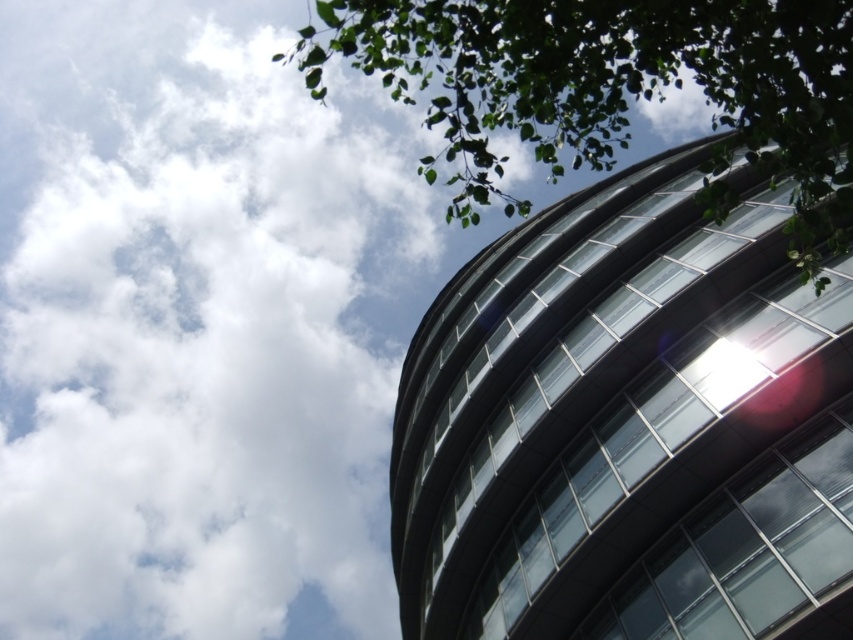
The height and width of the screenshot is (640, 853). What do you see at coordinates (196, 326) in the screenshot?
I see `white fluffy cloud at upper left` at bounding box center [196, 326].

Can you confirm if white fluffy cloud at upper left is smaller than transparent glass building at upper right?

Actually, white fluffy cloud at upper left might be larger than transparent glass building at upper right.

Between point (4, 285) and point (801, 580), which one is positioned in front?

Point (801, 580) is in front.

Where is `white fluffy cloud at upper left`? white fluffy cloud at upper left is located at coordinates (196, 326).

What do you see at coordinates (627, 422) in the screenshot? This screenshot has height=640, width=853. I see `transparent glass building at upper right` at bounding box center [627, 422].

Is transparent glass building at upper right wider than green leafy tree at upper right?

No.

Is point (534, 269) less distant than point (422, 51)?

No, (534, 269) is behind (422, 51).

This screenshot has width=853, height=640. I want to click on transparent glass building at upper right, so click(627, 422).

Which is behind, point (158, 196) or point (746, 157)?

The point (158, 196) is more distant.

Who is more forward, [39,508] or [506,42]?

Point [506,42] is more forward.

Identify the location of white fluffy cloud at upper left. (196, 326).